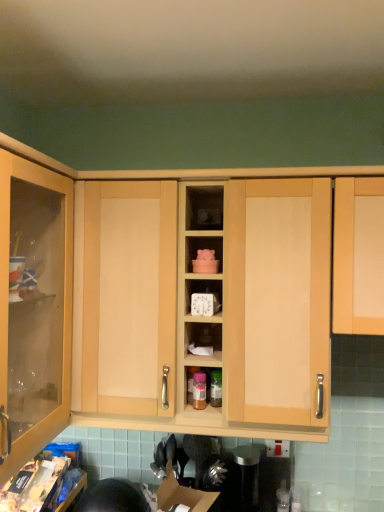
Question: In terms of size, does matte wood clock at center appear bigger or smaller than satin silver canister at center?

Choices:
 (A) small
 (B) big

Answer: (A)

Question: Is matte wood clock at center inside the boundaries of satin silver canister at center, or outside?

Choices:
 (A) outside
 (B) inside

Answer: (A)

Question: Which of these objects is positioned closest to the matte wood clock at center?

Choices:
 (A) matte wood cabinet at center
 (B) light wood cabinet at right
 (C) satin silver canister at center

Answer: (A)

Question: Based on their relative distances, which object is nearer to the matte wood clock at center?

Choices:
 (A) matte wood cabinet at center
 (B) light wood cabinet at right
 (C) satin silver canister at center

Answer: (A)